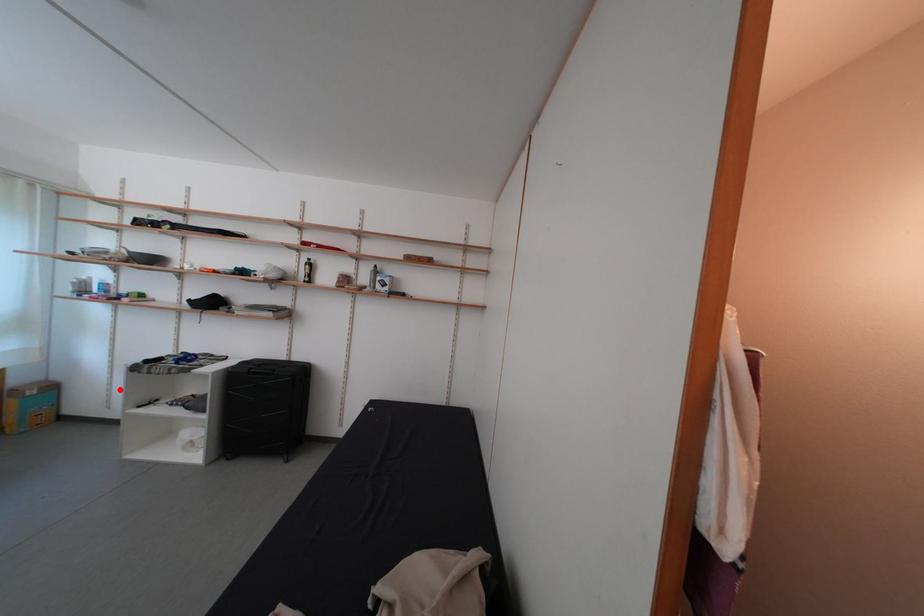
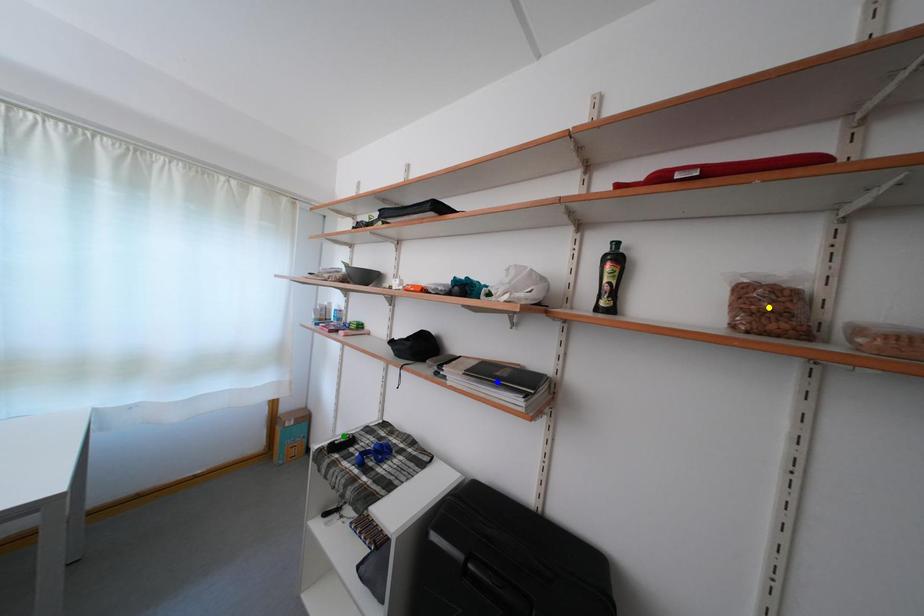
Question: I am providing you with two images of the same scene from different viewpoints. A red point is marked on the first image. You are given multiple points on the second image. Can you choose the point in image 2 that corresponds to the point in image 1?

Choices:
 (A) blue point
 (B) green point
 (C) yellow point

Answer: (B)